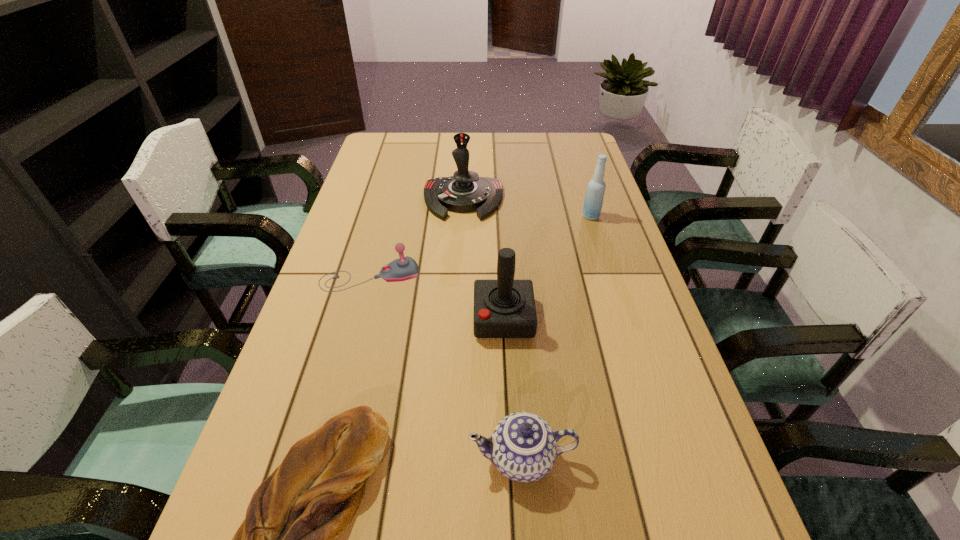
The image size is (960, 540). Identify the location of free point at the far left corner. (392, 140).

The image size is (960, 540). What are the coordinates of `free space at the far right corner of the desktop` in the screenshot? It's located at (585, 135).

Locate an element on the screen. The width and height of the screenshot is (960, 540). free spot between the second shortest object and the farthest joystick is located at coordinates (417, 238).

Identify the location of free spot between the chinaware and the shortest joystick. This screenshot has width=960, height=540. (446, 367).

This screenshot has width=960, height=540. Find the location of `vacant area between the nearest joystick and the chinaware`. vacant area between the nearest joystick and the chinaware is located at coordinates (513, 388).

You are a GUI agent. You are given a task and a screenshot of the screen. Output one action in this format:
    pyautogui.click(x=<x>, y=<y>)
    Task: Click on the empty space that is in between the nearest joystick and the farthest joystick
    The height and width of the screenshot is (540, 960).
    Given the screenshot: What is the action you would take?
    pyautogui.click(x=483, y=259)

Identify the location of vacant space that is in between the bottle and the farthest joystick. (527, 208).

The width and height of the screenshot is (960, 540). I want to click on free space between the rightmost object and the chinaware, so click(557, 337).

In order to click on object that is the fifth closest to the farthest joystick in this screenshot , I will do coord(523,447).

Locate which object ranks third in proximity to the chinaware. Please provide its 2D coordinates. Your answer should be formatted as a tuple, i.e. [(x, y)], where the tuple contains the x and y coordinates of a point satisfying the conditions above.

[(404, 268)]